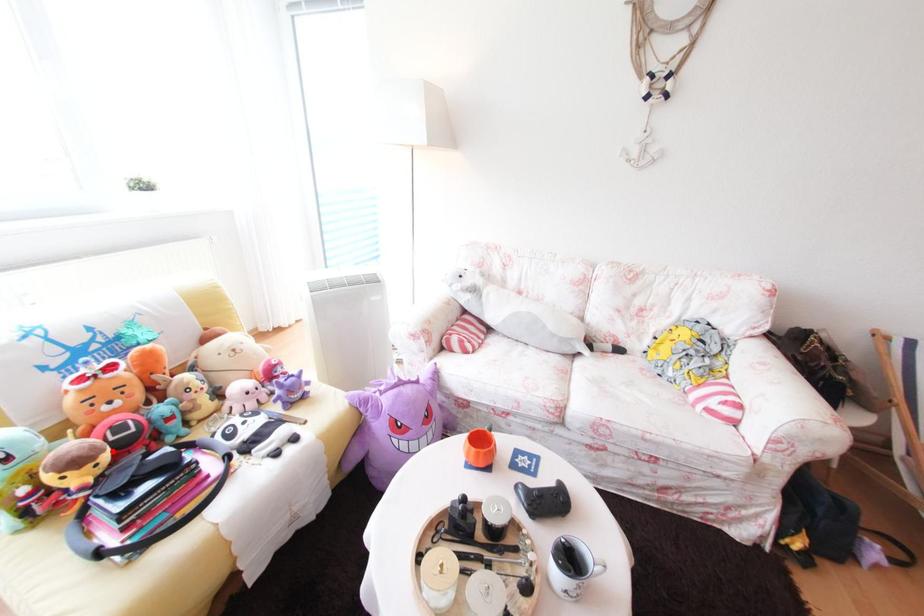
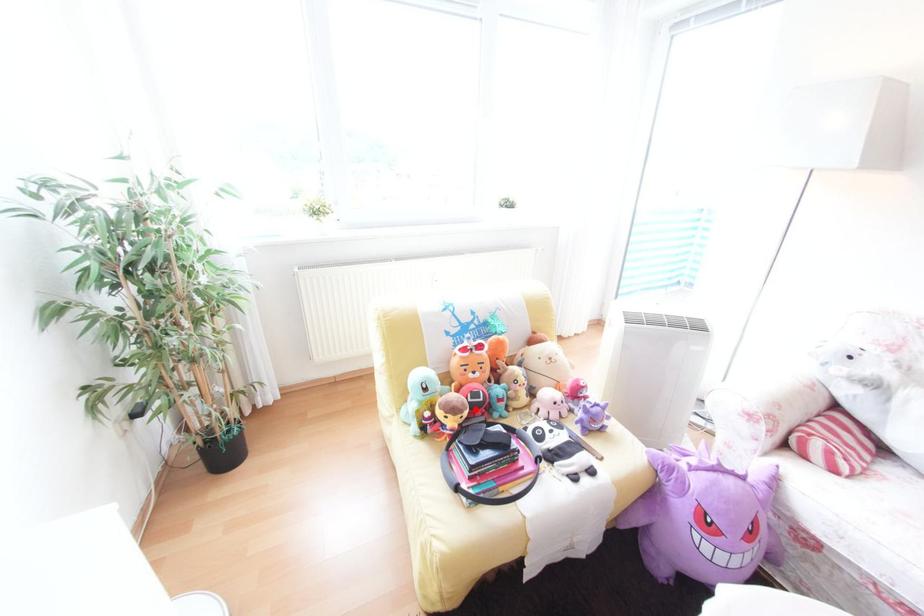
I am providing you with two images of the same scene from different viewpoints. A red point is marked on the first image and another point is marked on the second image. Do the highlighted points in image1 and image2 indicate the same real-world spot?

Yes